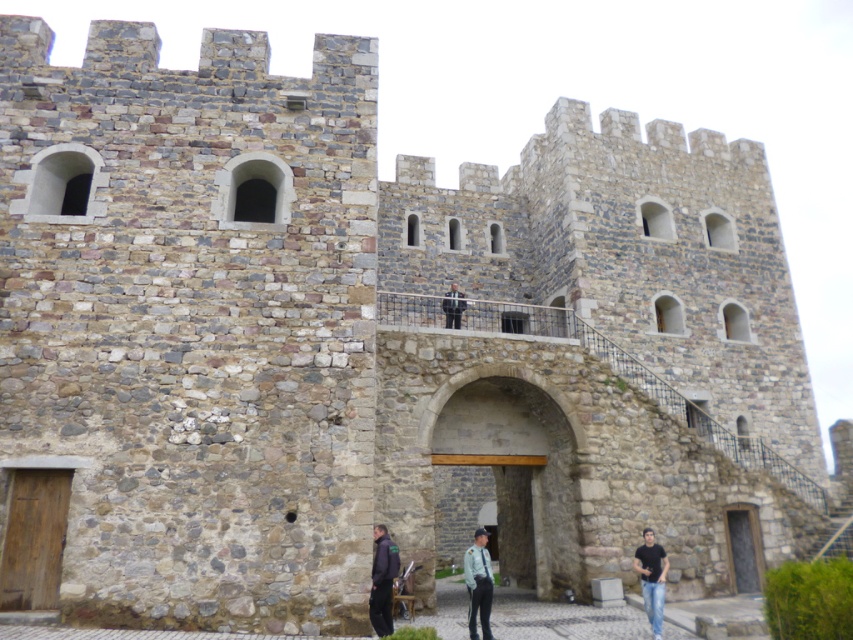
From the picture: Does jeans at center have a greater height compared to black matte shirt at lower right?

Correct, jeans at center is much taller as black matte shirt at lower right.

Is jeans at center bigger than black matte shirt at lower right?

Indeed, jeans at center has a larger size compared to black matte shirt at lower right.

Measure the distance between point (395, 632) and camera.

Point (395, 632) and camera are 103.69 feet apart from each other.

The height and width of the screenshot is (640, 853). I want to click on jeans at center, so click(523, 608).

Which is behind, point (376, 557) or point (653, 540)?

The point (653, 540) is behind.

How distant is dark gray fabric jacket at lower center from black matte shirt at lower right?

They are 42.78 feet apart.

Is point (389, 579) farther from viewer compared to point (647, 536)?

No, it is not.

At what (x,y) coordinates should I click in order to perform the action: click on dark gray fabric jacket at lower center. Please return your answer as a coordinate pair (x, y). The height and width of the screenshot is (640, 853). Looking at the image, I should click on (381, 580).

Can you confirm if jeans at center is positioned to the right of dark gray stone door at center?

Incorrect, jeans at center is not on the right side of dark gray stone door at center.

Does jeans at center have a smaller size compared to dark gray stone door at center?

No, jeans at center is not smaller than dark gray stone door at center.

What are the coordinates of `jeans at center` in the screenshot? It's located at (523, 608).

Find the location of a particular element. The height and width of the screenshot is (640, 853). jeans at center is located at coordinates (523, 608).